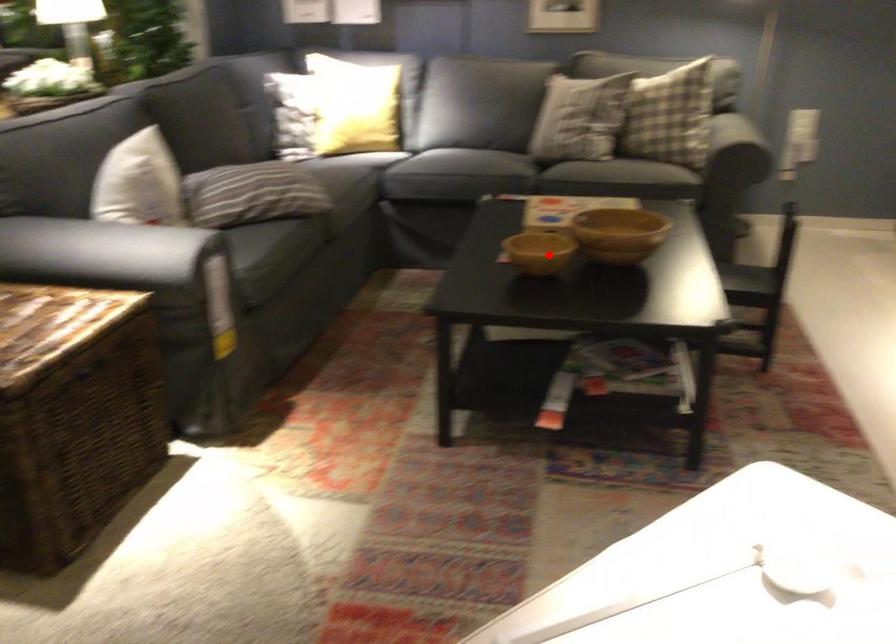
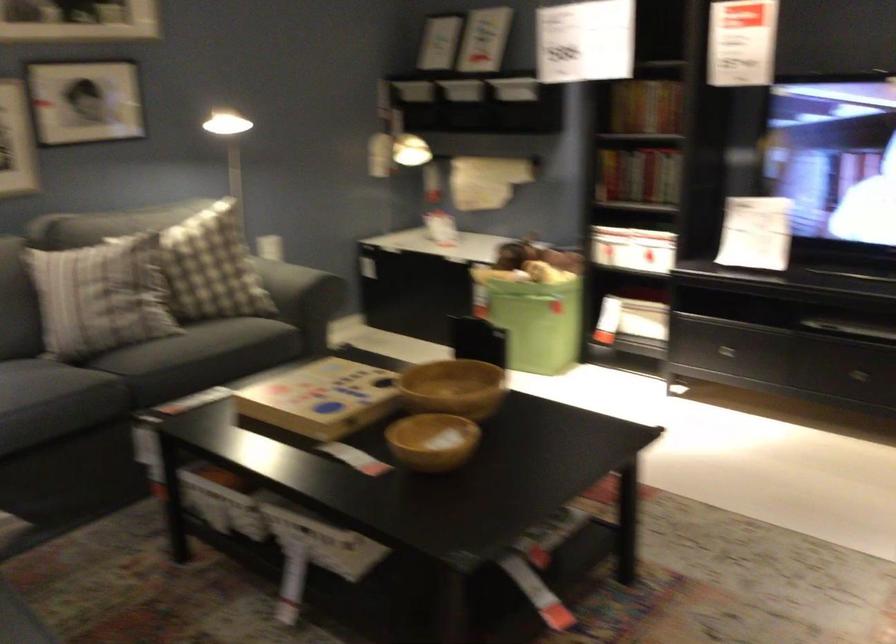
In the second image, find the point that corresponds to the highlighted location in the first image.

(433, 440)